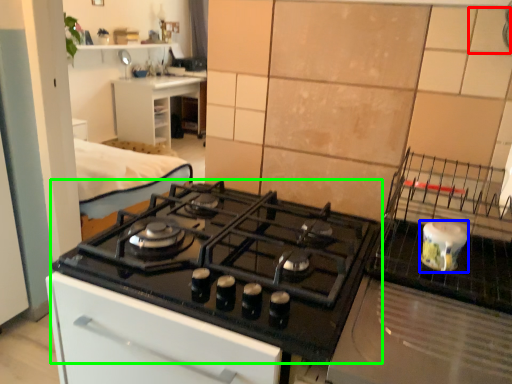
Question: Which object is positioned farthest from tile (highlighted by a red box)? Select from kitchen appliance (highlighted by a blue box) and gas stove (highlighted by a green box).

Choices:
 (A) kitchen appliance
 (B) gas stove

Answer: (B)